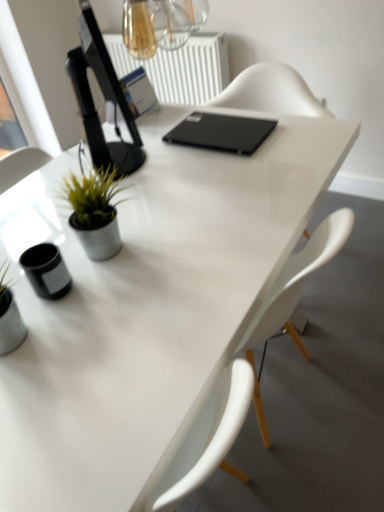
Locate an element on the screen. free space that is to the left of green matte plant at left is located at coordinates (52, 234).